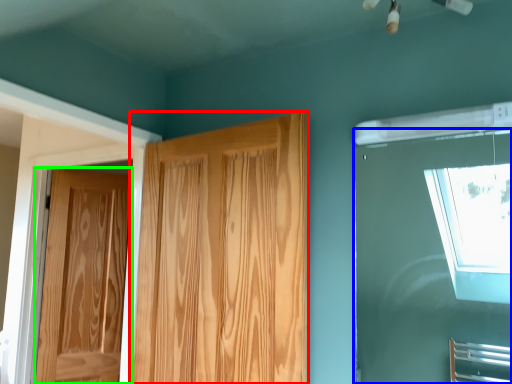
Question: Based on their relative distances, which object is farther from door (highlighted by a red box)? Choose from window (highlighted by a blue box) and door (highlighted by a green box).

Choices:
 (A) window
 (B) door

Answer: (A)